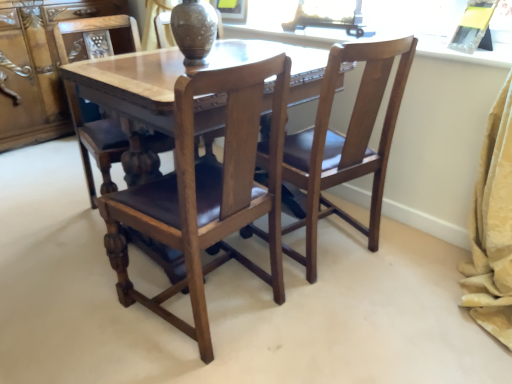
The image size is (512, 384). I want to click on space that is in front of wooden polished table at center, so click(226, 334).